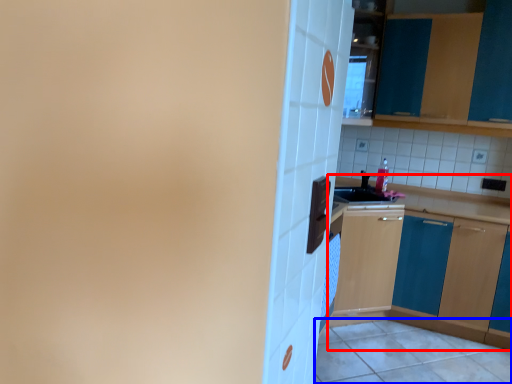
Question: Which object appears closest to the camera in this image, cabinetry (highlighted by a red box) or tile (highlighted by a blue box)?

Choices:
 (A) cabinetry
 (B) tile

Answer: (B)